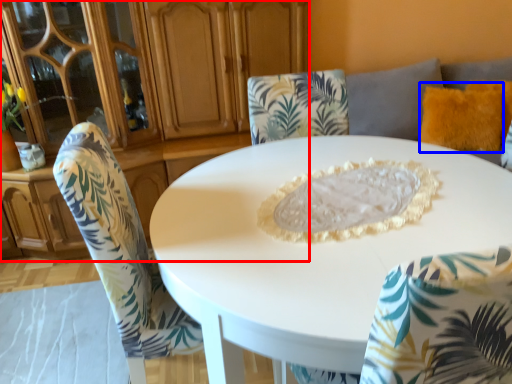
Question: Which object is closer to the camera taking this photo, dresser (highlighted by a red box) or pillow (highlighted by a blue box)?

Choices:
 (A) dresser
 (B) pillow

Answer: (A)